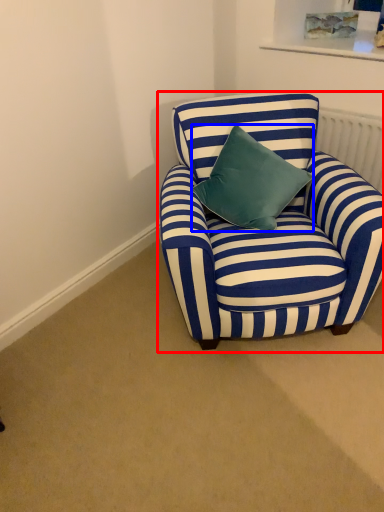
Question: Which object appears closest to the camera in this image, chair (highlighted by a red box) or pillow (highlighted by a blue box)?

Choices:
 (A) chair
 (B) pillow

Answer: (A)